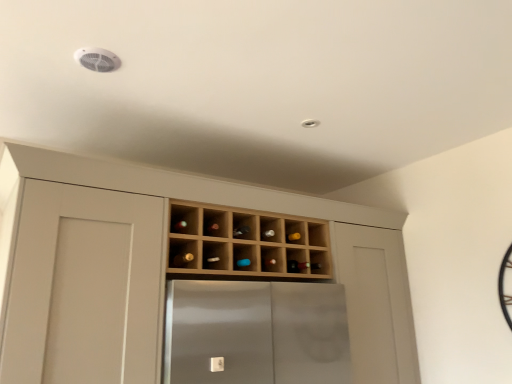
Question: From the image's perspective, is wooden wine rack at center over light wood wine rack at center?

Choices:
 (A) yes
 (B) no

Answer: (A)

Question: Does wooden wine rack at center appear on the left side of light wood wine rack at center?

Choices:
 (A) yes
 (B) no

Answer: (B)

Question: From the image's perspective, is wooden wine rack at center below light wood wine rack at center?

Choices:
 (A) no
 (B) yes

Answer: (A)

Question: Considering the relative sizes of wooden wine rack at center and light wood wine rack at center in the image provided, is wooden wine rack at center taller than light wood wine rack at center?

Choices:
 (A) no
 (B) yes

Answer: (A)

Question: From a real-world perspective, is wooden wine rack at center beneath light wood wine rack at center?

Choices:
 (A) yes
 (B) no

Answer: (B)

Question: Is wooden wine rack at center smaller than light wood wine rack at center?

Choices:
 (A) no
 (B) yes

Answer: (B)

Question: Is light wood wine rack at center bigger than wooden wine rack at center?

Choices:
 (A) no
 (B) yes

Answer: (B)

Question: Considering the relative positions of light wood wine rack at center and wooden wine rack at center in the image provided, is light wood wine rack at center to the left of wooden wine rack at center from the viewer's perspective?

Choices:
 (A) no
 (B) yes

Answer: (B)

Question: Is light wood wine rack at center closer to camera compared to wooden wine rack at center?

Choices:
 (A) yes
 (B) no

Answer: (A)

Question: Is light wood wine rack at center positioned behind wooden wine rack at center?

Choices:
 (A) no
 (B) yes

Answer: (A)

Question: Are light wood wine rack at center and wooden wine rack at center beside each other?

Choices:
 (A) yes
 (B) no

Answer: (B)

Question: From a real-world perspective, is light wood wine rack at center beneath wooden wine rack at center?

Choices:
 (A) no
 (B) yes

Answer: (B)

Question: Can wooden wine rack at center be found inside matte brown wine bottle at center, positioned as the 2th wine bottle in right-to-left order?

Choices:
 (A) yes
 (B) no

Answer: (B)